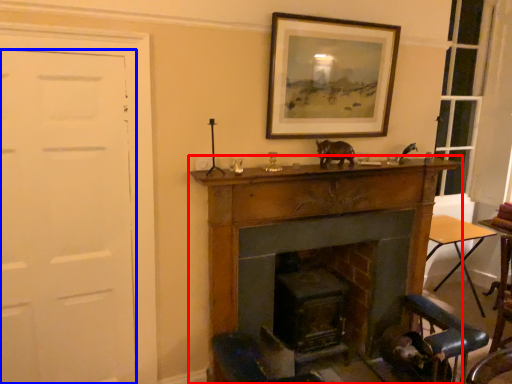
Question: Which object appears farthest to the camera in this image, fireplace (highlighted by a red box) or door (highlighted by a blue box)?

Choices:
 (A) fireplace
 (B) door

Answer: (A)